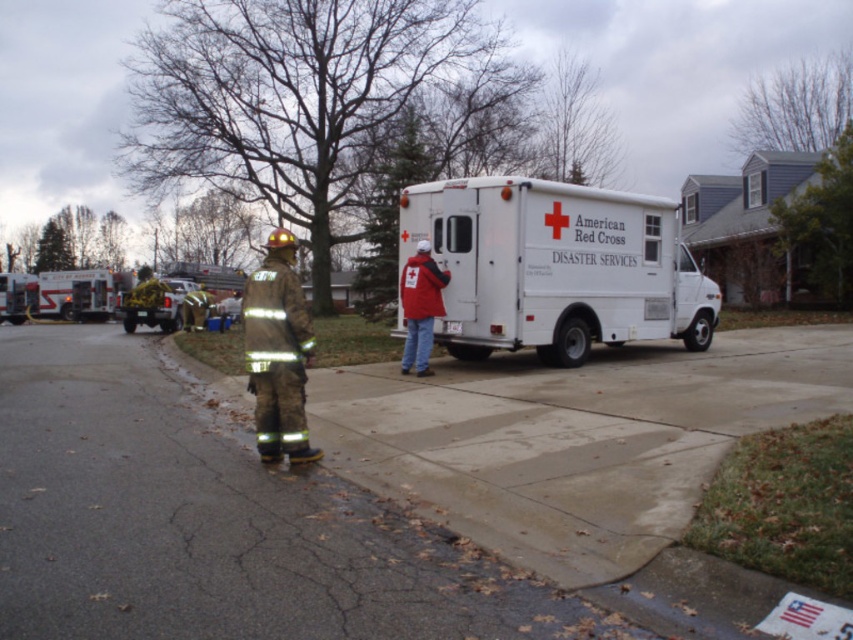
Consider the image. Does camouflage fabric fireman at center have a larger size compared to red matte jacket at center?

Incorrect, camouflage fabric fireman at center is not larger than red matte jacket at center.

Is point (259, 371) farther from viewer compared to point (428, 264)?

No.

Looking at this image, measure the distance between point (273, 276) and camera.

7.38 meters

You are a GUI agent. You are given a task and a screenshot of the screen. Output one action in this format:
    pyautogui.click(x=<x>, y=<y>)
    Task: Click on the camouflage fabric fireman at center
    This screenshot has height=640, width=853.
    Given the screenshot: What is the action you would take?
    pyautogui.click(x=277, y=353)

Is yellow reflective truck at left thinner than reflective gold fireman at center?

In fact, yellow reflective truck at left might be wider than reflective gold fireman at center.

Which is behind, point (177, 298) or point (194, 324)?

The point (177, 298) is behind.

Which is in front, point (167, 307) or point (196, 304)?

Positioned in front is point (196, 304).

The image size is (853, 640). I want to click on yellow reflective truck at left, so click(154, 305).

Can you confirm if brushed metal fire truck at left is positioned to the left of reflective fabric fireman at center?

Correct, you'll find brushed metal fire truck at left to the left of reflective fabric fireman at center.

Can you confirm if brushed metal fire truck at left is thinner than reflective fabric fireman at center?

No, brushed metal fire truck at left is not thinner than reflective fabric fireman at center.

Find the location of a particular element. brushed metal fire truck at left is located at coordinates (62, 294).

Locate an element on the screen. The image size is (853, 640). brushed metal fire truck at left is located at coordinates (62, 294).